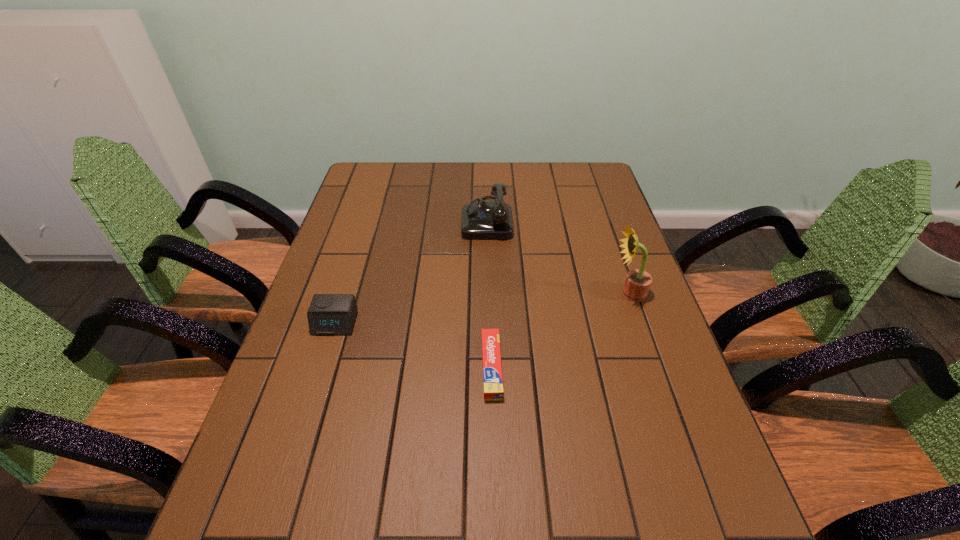
Find the location of a particular element. This screenshot has width=960, height=540. the rightmost object is located at coordinates (637, 283).

Where is `the second farthest object`? The image size is (960, 540). the second farthest object is located at coordinates (637, 283).

Find the location of a particular element. Image resolution: width=960 pixels, height=540 pixels. telephone is located at coordinates (483, 219).

This screenshot has width=960, height=540. In order to click on the third shortest object in this screenshot , I will do `click(483, 219)`.

Locate an element on the screen. The width and height of the screenshot is (960, 540). the third tallest object is located at coordinates (329, 314).

At what (x,y) coordinates should I click in order to perform the action: click on the leftmost object. Please return your answer as a coordinate pair (x, y). This screenshot has height=540, width=960. Looking at the image, I should click on (329, 314).

Find the location of a particular element. Image resolution: width=960 pixels, height=540 pixels. the nearest object is located at coordinates (492, 371).

Identify the location of the shortest object. The width and height of the screenshot is (960, 540). [492, 371].

Where is `free space located 0.050m on the face of the sunflower`? The image size is (960, 540). free space located 0.050m on the face of the sunflower is located at coordinates (593, 293).

Locate an element on the screen. free location located 0.200m on the face of the sunflower is located at coordinates (538, 293).